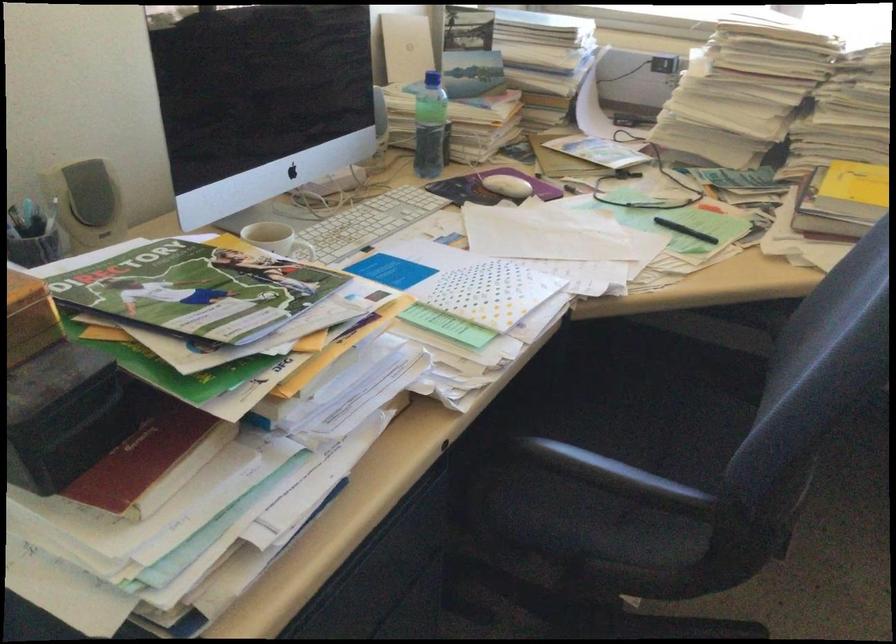
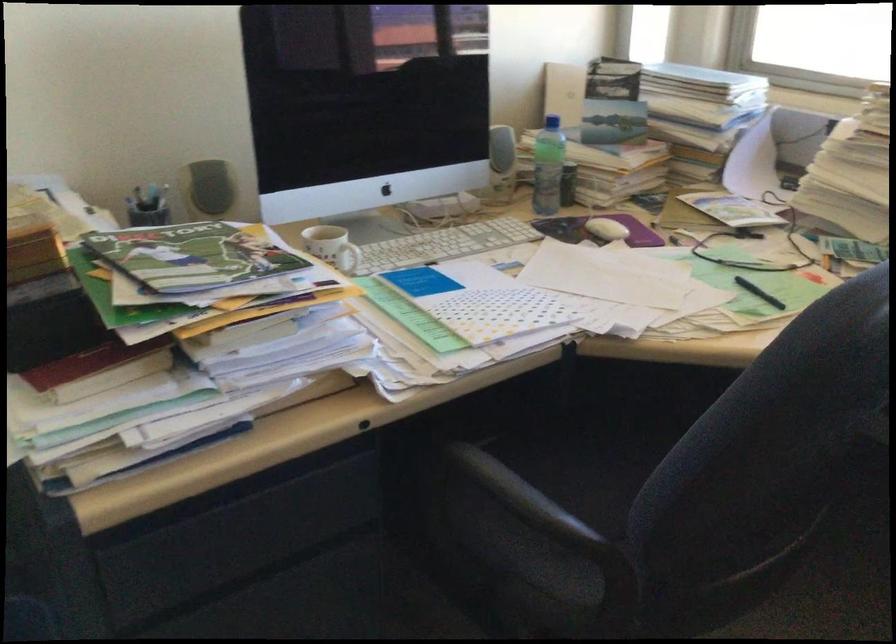
Question: Based on the continuous images, in which direction is the camera rotating? Reply with the corresponding letter.

Choices:
 (A) Left
 (B) Right
 (C) Up
 (D) Down

Answer: (A)